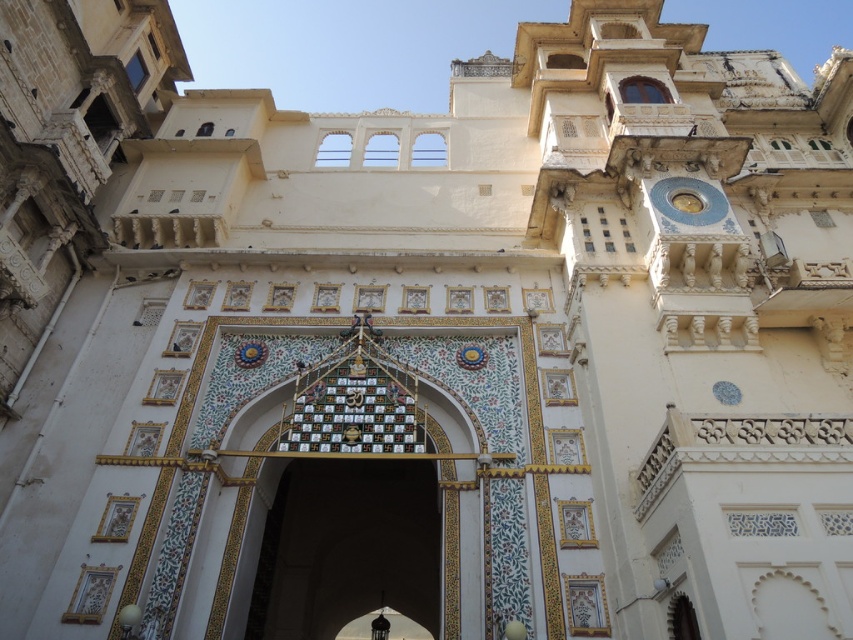
Question: Which of the following is the farthest from the observer?

Choices:
 (A) gold metallic clock at upper right
 (B) white marble archway at center

Answer: (A)

Question: Is white marble archway at center behind gold metallic clock at upper right?

Choices:
 (A) yes
 (B) no

Answer: (B)

Question: Does white marble archway at center appear under gold metallic clock at upper right?

Choices:
 (A) yes
 (B) no

Answer: (A)

Question: Which point is closer to the camera?

Choices:
 (A) white marble archway at center
 (B) gold metallic clock at upper right

Answer: (A)

Question: Does white marble archway at center have a greater width compared to gold metallic clock at upper right?

Choices:
 (A) yes
 (B) no

Answer: (A)